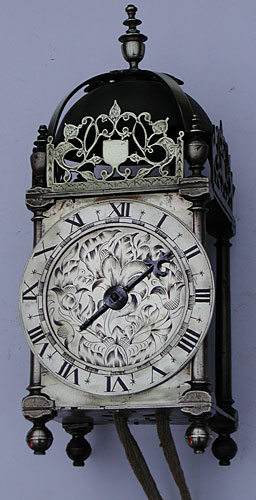
I want to click on filigree design at top of clock, so click(66, 144), click(164, 145), click(117, 110).